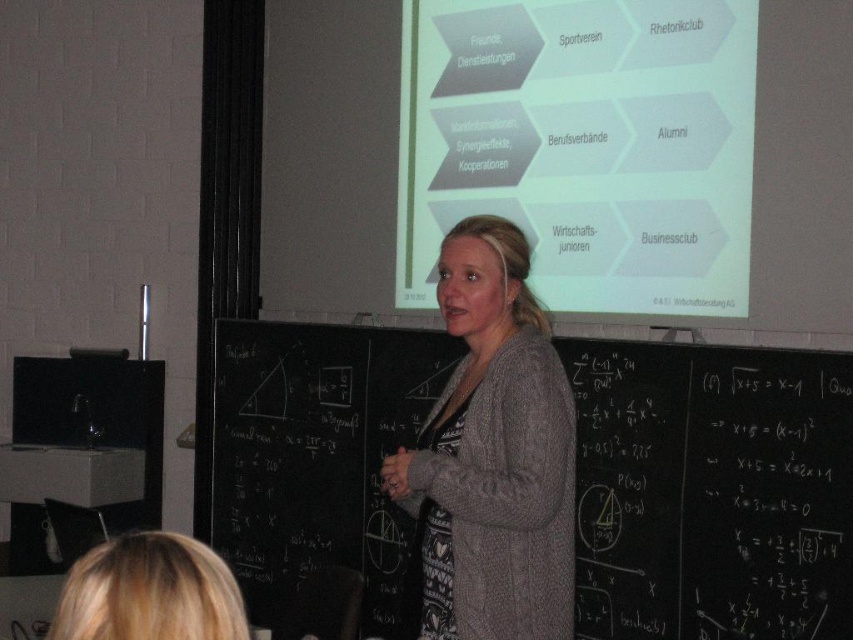
You are a student sitting in the classroom and want to take a photo of the black chalkboard at center and the blonde hair at lower left. Which object will appear larger in the photo?

The black chalkboard at center will appear larger in the photo because it is much taller than the blonde hair at lower left.

You are a student sitting in the classroom and want to point out the green matte projector screen at upper center to a classmate. Which direction should you indicate relative to the blonde hair at lower left?

The green matte projector screen at upper center is located to the right of the blonde hair at lower left, so you should indicate the right direction relative to the blonde hair at lower left.